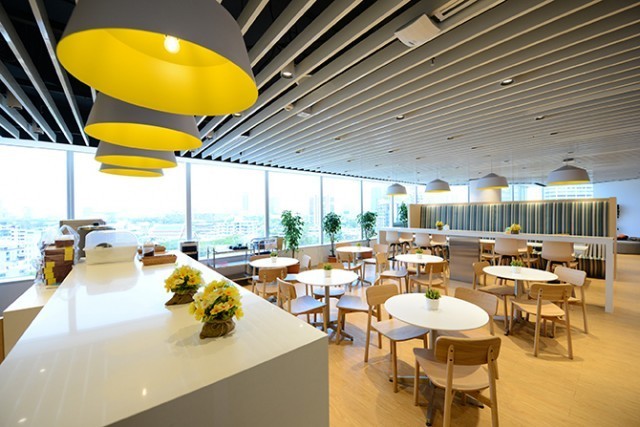
Where is `wooden tables`? wooden tables is located at coordinates (440, 314), (328, 277), (267, 259), (352, 252), (413, 260), (523, 275), (534, 247), (396, 237), (438, 241).